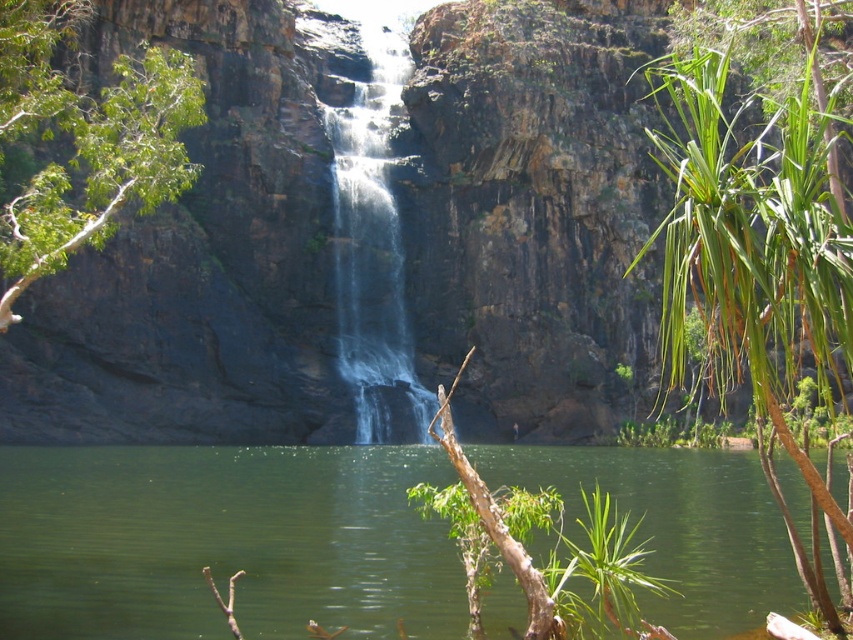
Does green liquid water at center have a smaller size compared to green leafy plant at right?

Yes, green liquid water at center is smaller than green leafy plant at right.

Is green liquid water at center bigger than green leafy plant at right?

No, green liquid water at center is not bigger than green leafy plant at right.

You are a GUI agent. You are given a task and a screenshot of the screen. Output one action in this format:
    pyautogui.click(x=<x>, y=<y>)
    Task: Click on the green liquid water at center
    Image resolution: width=853 pixels, height=640 pixels.
    Given the screenshot: What is the action you would take?
    pyautogui.click(x=223, y=541)

Does green liquid water at center appear under clear water at center?

Yes, green liquid water at center is below clear water at center.

Is point (311, 566) positioned before point (368, 400)?

Yes.

Describe the element at coordinates (223, 541) in the screenshot. I see `green liquid water at center` at that location.

At what (x,y) coordinates should I click in order to perform the action: click on green liquid water at center. Please return your answer as a coordinate pair (x, y). Looking at the image, I should click on (223, 541).

Where is `green leafy plant at right`? The height and width of the screenshot is (640, 853). green leafy plant at right is located at coordinates (753, 244).

Which is more to the left, green leafy plant at right or clear water at center?

From the viewer's perspective, clear water at center appears more on the left side.

Find the location of a particular element. This screenshot has height=640, width=853. green leafy plant at right is located at coordinates (753, 244).

What are the coordinates of `green leafy plant at right` in the screenshot? It's located at click(x=753, y=244).